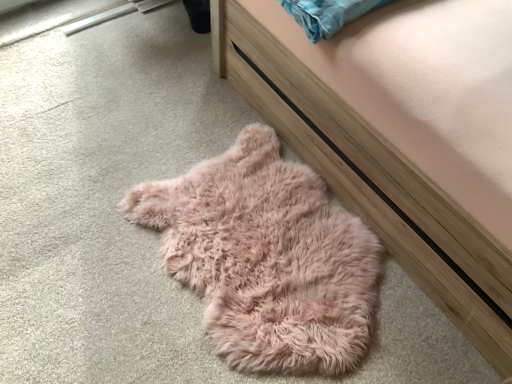
This screenshot has height=384, width=512. I want to click on empty space that is ontop of fuzzy pink rug at lower left (from a real-world perspective), so (262, 248).